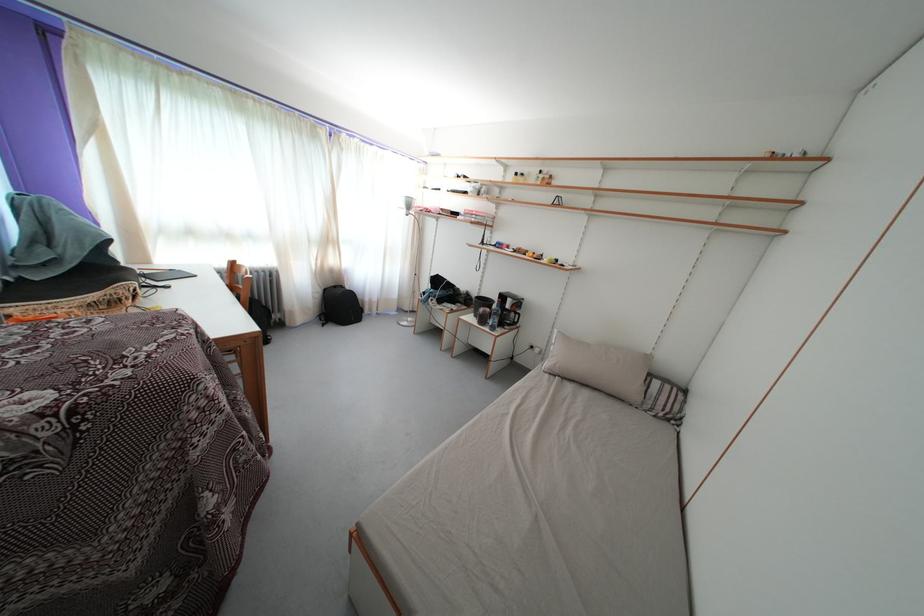
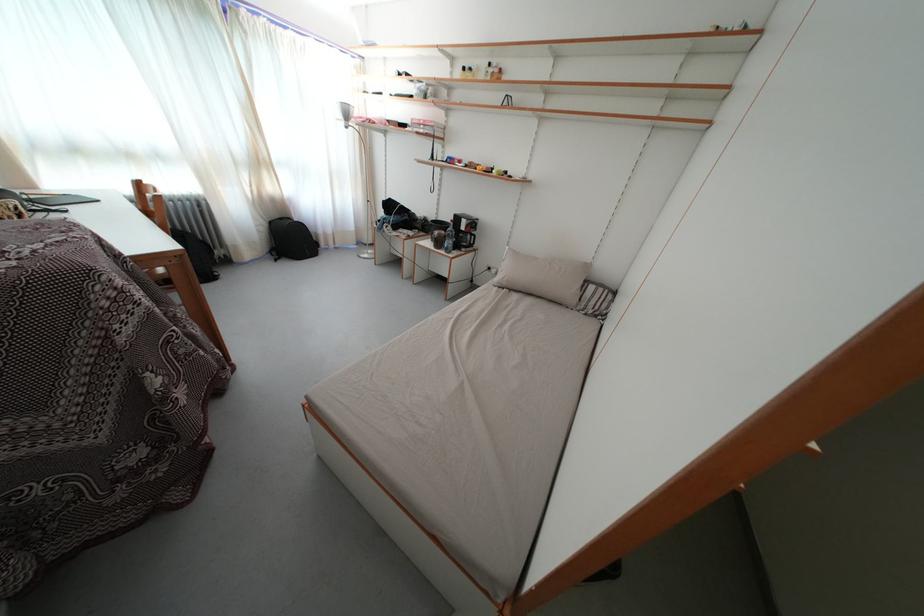
Where in the second image is the point corresponding to point 326,297 from the first image?

(272, 230)